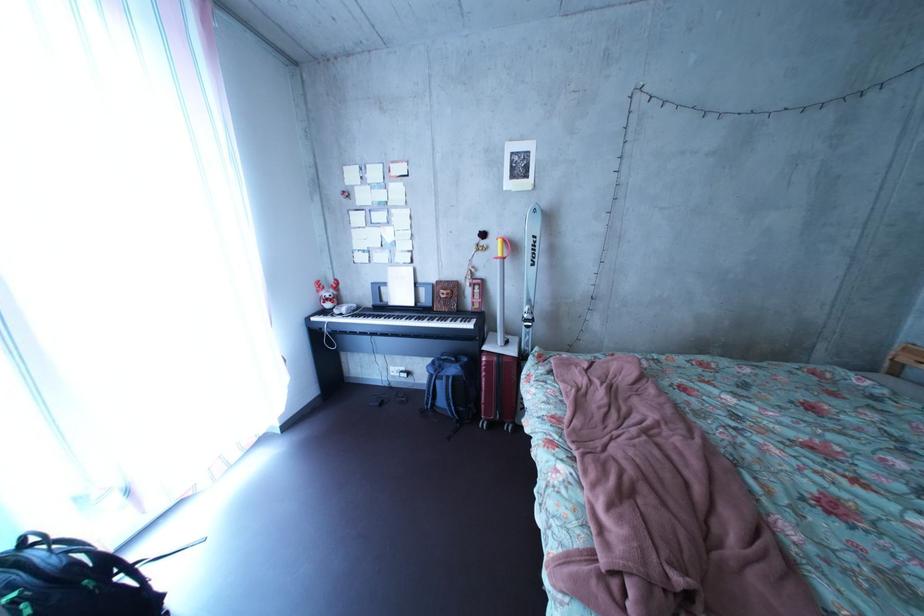
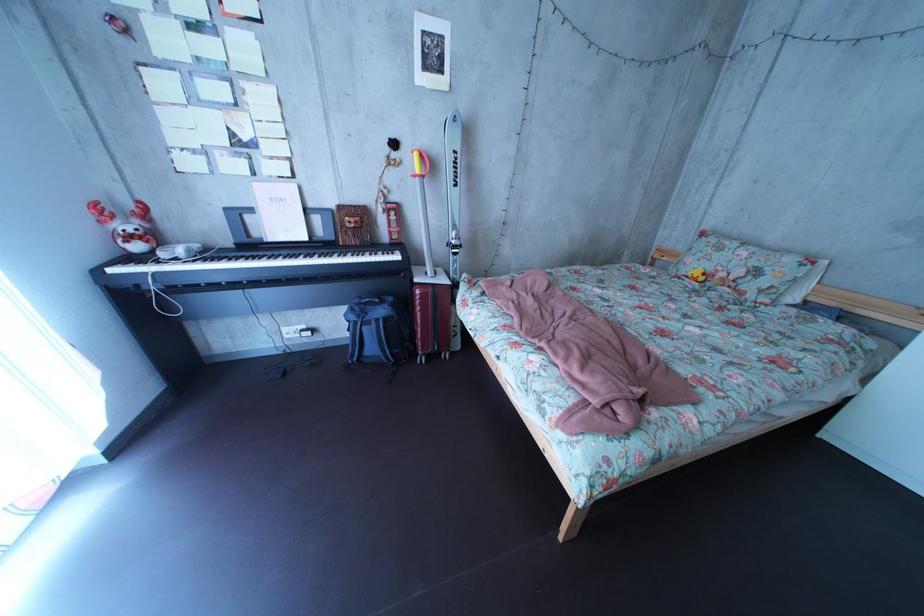
Locate, in the second image, the point that corresponds to (458,300) in the first image.

(367, 228)